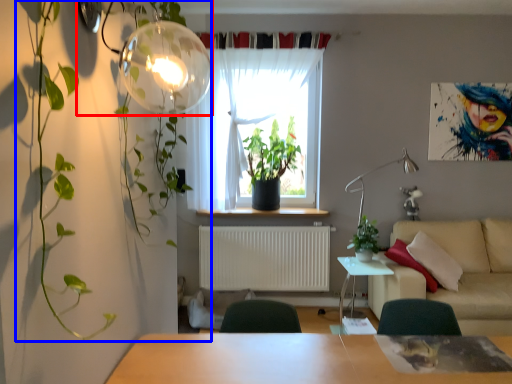
Question: Which of the following is the closest to the observer, lamp (highlighted by a red box) or vegetation (highlighted by a blue box)?

Choices:
 (A) lamp
 (B) vegetation

Answer: (B)